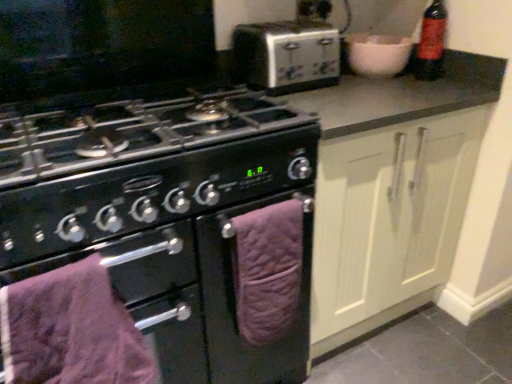
Question: Does silver metallic toaster at upper center have a larger size compared to purple quilted towel at lower center, the 2th oven viewed from the left?

Choices:
 (A) no
 (B) yes

Answer: (B)

Question: From the image's perspective, is silver metallic toaster at upper center located beneath purple quilted towel at lower center, the 2th oven viewed from the left?

Choices:
 (A) no
 (B) yes

Answer: (A)

Question: Is silver metallic toaster at upper center thinner than purple quilted towel at lower center, the first oven viewed from the right?

Choices:
 (A) no
 (B) yes

Answer: (A)

Question: Is silver metallic toaster at upper center far away from purple quilted towel at lower center, the 2th oven viewed from the left?

Choices:
 (A) no
 (B) yes

Answer: (A)

Question: Considering the relative positions of silver metallic toaster at upper center and purple quilted towel at lower center, the 2th oven viewed from the left, in the image provided, is silver metallic toaster at upper center to the right of purple quilted towel at lower center, the 2th oven viewed from the left, from the viewer's perspective?

Choices:
 (A) yes
 (B) no

Answer: (A)

Question: Is purple quilted towel at lower left wider or thinner than purple quilted towel at lower center, the first oven viewed from the right?

Choices:
 (A) wide
 (B) thin

Answer: (A)

Question: From a real-world perspective, is purple quilted towel at lower left physically located above or below purple quilted towel at lower center, the first oven viewed from the right?

Choices:
 (A) above
 (B) below

Answer: (A)

Question: From the image's perspective, relative to purple quilted towel at lower center, the first oven viewed from the right, is purple quilted towel at lower left above or below?

Choices:
 (A) below
 (B) above

Answer: (A)

Question: Which is correct: purple quilted towel at lower left is inside purple quilted towel at lower center, the first oven viewed from the right, or outside of it?

Choices:
 (A) outside
 (B) inside

Answer: (A)

Question: Is purple quilted towel at lower center, the 2th oven viewed from the left, wider or thinner than black matte oven at center, which is counted as the 2th oven, starting from the right?

Choices:
 (A) wide
 (B) thin

Answer: (B)

Question: From a real-world perspective, is purple quilted towel at lower center, the first oven viewed from the right, positioned above or below black matte oven at center, positioned as the 1th oven in left-to-right order?

Choices:
 (A) above
 (B) below

Answer: (A)

Question: Considering the positions of point (241, 299) and point (238, 206), is point (241, 299) closer or farther from the camera than point (238, 206)?

Choices:
 (A) closer
 (B) farther

Answer: (B)

Question: Relative to black matte oven at center, positioned as the 1th oven in left-to-right order, is purple quilted towel at lower center, the 2th oven viewed from the left, in front or behind?

Choices:
 (A) behind
 (B) front

Answer: (A)

Question: Considering the positions of point (270, 41) and point (286, 223), is point (270, 41) closer or farther from the camera than point (286, 223)?

Choices:
 (A) farther
 (B) closer

Answer: (A)

Question: Is silver metallic toaster at upper center to the left or to the right of purple quilted towel at lower center, the 2th oven viewed from the left, in the image?

Choices:
 (A) left
 (B) right

Answer: (B)